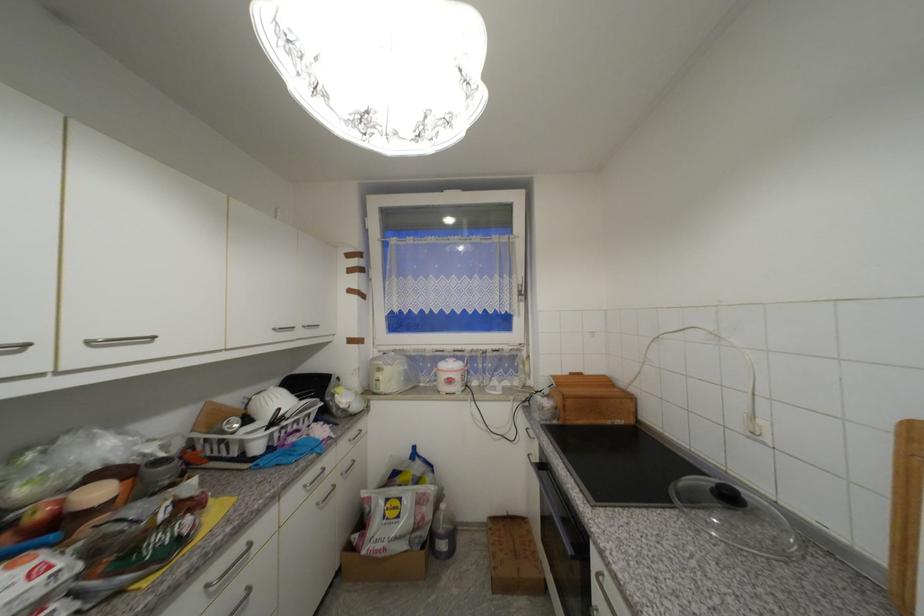
Find the location of a particular element. This screenshot has height=616, width=924. long cardboard box is located at coordinates (313, 477).